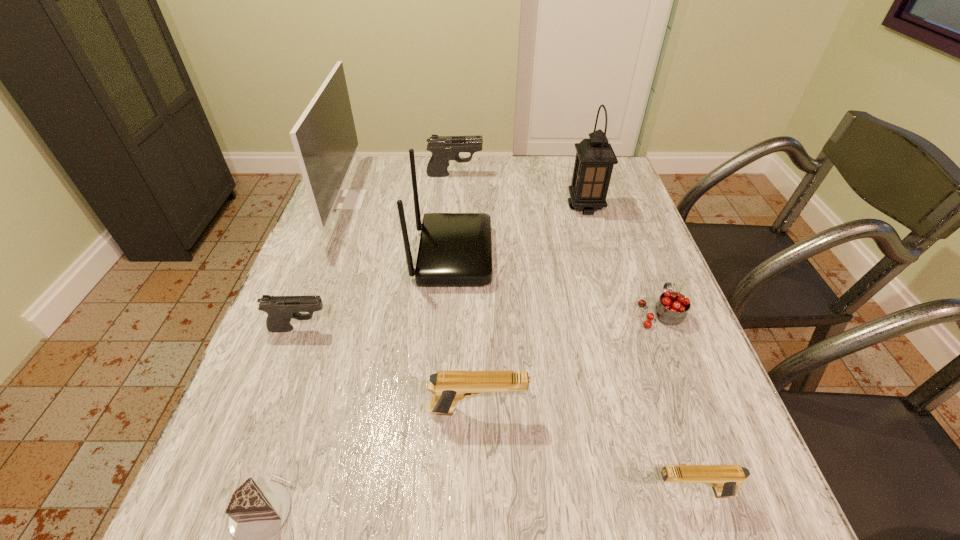
Identify the location of free space that satisfies the following two spatial constraints: 1. at the barrel of the farther black pistol; 2. on the right side of the lantern. (452, 207).

At what (x,y) coordinates should I click in order to perform the action: click on free space that satisfies the following two spatial constraints: 1. on the front-facing side of the monitor; 2. on the left side of the black lantern. Please return your answer as a coordinate pair (x, y). This screenshot has width=960, height=540. Looking at the image, I should click on (344, 207).

At what (x,y) coordinates should I click in order to perform the action: click on free location that satisfies the following two spatial constraints: 1. at the barrel of the tallest pistol; 2. on the back side of the black lantern. Please return your answer as a coordinate pair (x, y). Looking at the image, I should click on (452, 207).